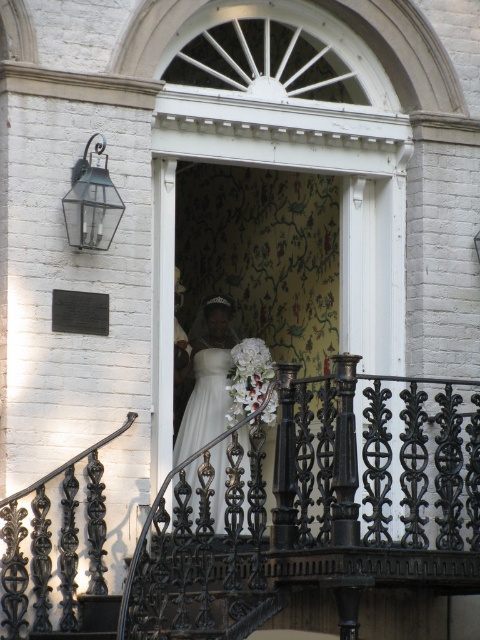
The bride wants to hand her bouquet to her maid of honor who is standing 4 meters away from her. Based on the distance between the white satin dress at center and the white silk bouquet at center, will the bouquet reach the maid of honor?

The distance between the white satin dress at center and the white silk bouquet at center is 3.85 meters. Since the maid of honor is 4 meters away, the bouquet will not quite reach her.

Based on the scene description, where is the white satin dress at center located in terms of its 2D coordinates?

The white satin dress at center is located at the 2D coordinates point (207, 380).

You are a photographer setting up for a wedding photo. The bride is standing behind the black wrought iron railing at center holding the white silk bouquet at center. You want to ensure the bouquet is clearly visible in the photo. Given their sizes, which object should you focus on to make sure the bouquet stands out?

The black wrought iron railing at center is bigger than the white silk bouquet at center, so focusing on the bouquet will help it stand out more clearly in the photo.